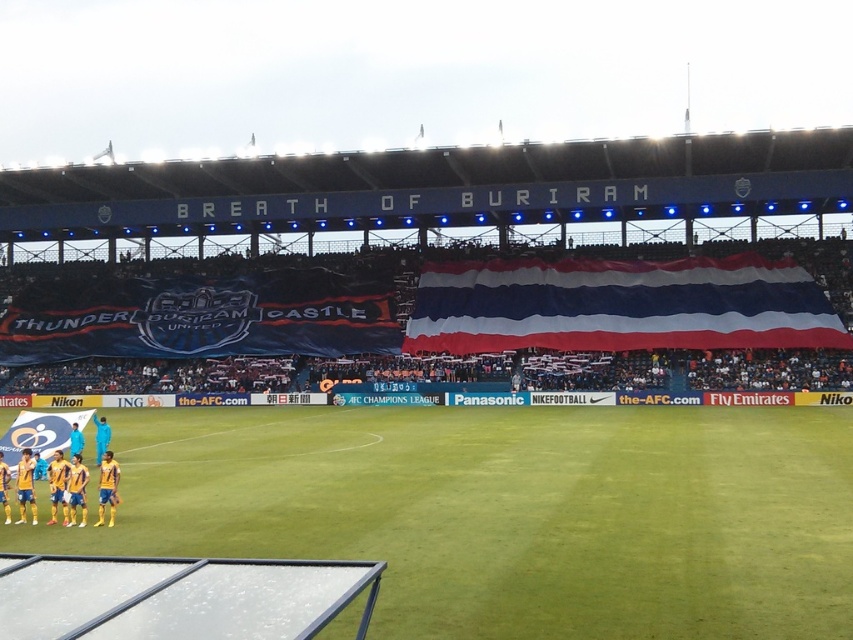
Who is more distant from viewer, (584, 292) or (42, 436)?

The point (584, 292) is more distant.

Is red-white-blue fabric at upper center positioned behind yellow matte jersey at lower left?

Yes.

Identify the location of red-white-blue fabric at upper center. This screenshot has width=853, height=640. (619, 305).

At what (x,y) coordinates should I click in order to perform the action: click on red-white-blue fabric at upper center. Please return your answer as a coordinate pair (x, y). The width and height of the screenshot is (853, 640). Looking at the image, I should click on (619, 305).

I want to click on green grass football field at lower center, so click(509, 513).

The height and width of the screenshot is (640, 853). What do you see at coordinates (509, 513) in the screenshot? I see `green grass football field at lower center` at bounding box center [509, 513].

Where is `green grass football field at lower center`? Image resolution: width=853 pixels, height=640 pixels. green grass football field at lower center is located at coordinates (509, 513).

Does green grass football field at lower center come behind yellow matte jersey at lower left?

That is False.

Between green grass football field at lower center and yellow matte jersey at lower left, which one has more height?

yellow matte jersey at lower left is taller.

Locate an element on the screen. green grass football field at lower center is located at coordinates (509, 513).